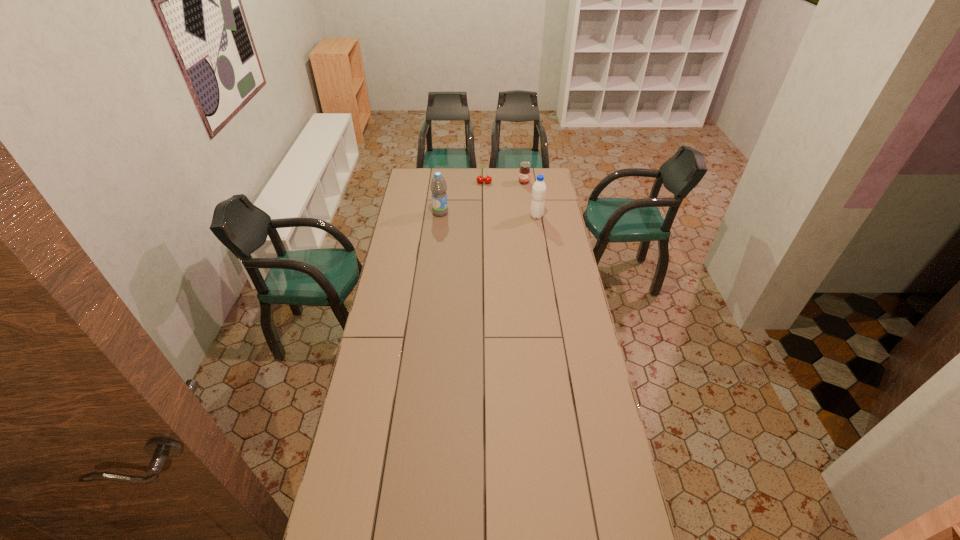
You are a GUI agent. You are given a task and a screenshot of the screen. Output one action in this format:
    pyautogui.click(x=<x>, y=<y>)
    Task: Click on the vacant region between the jam and the right water bottle
    The image size is (960, 540).
    Given the screenshot: What is the action you would take?
    pyautogui.click(x=530, y=199)

Identify the location of free space between the jam and the leftmost object. The image size is (960, 540). (482, 198).

At what (x,y) coordinates should I click in order to perform the action: click on blank region between the leftmost object and the cherry. Please return your answer as a coordinate pair (x, y). The height and width of the screenshot is (540, 960). Looking at the image, I should click on click(x=463, y=198).

Identify the location of free space between the jam and the left water bottle. (482, 198).

Where is `the closest object to the jam`? the closest object to the jam is located at coordinates (480, 179).

Identify which object is the second nearest to the third object from right to left. Please provide its 2D coordinates. Your answer should be formatted as a tuple, i.e. [(x, y)], where the tuple contains the x and y coordinates of a point satisfying the conditions above.

[(438, 185)]

Locate an element on the screen. The height and width of the screenshot is (540, 960). free location that satisfies the following two spatial constraints: 1. on the back side of the third object from right to left; 2. on the left side of the jam is located at coordinates (484, 183).

The image size is (960, 540). What are the coordinates of `vacant space that satisfies the following two spatial constraints: 1. on the back side of the second object from left to right; 2. on the right side of the jam` in the screenshot? It's located at (484, 183).

Identify the location of free location that satisfies the following two spatial constraints: 1. on the front side of the left water bottle; 2. on the left side of the right water bottle. This screenshot has height=540, width=960. (441, 216).

You are a GUI agent. You are given a task and a screenshot of the screen. Output one action in this format:
    pyautogui.click(x=<x>, y=<y>)
    Task: Click on the free space that satisfies the following two spatial constraints: 1. on the back side of the jam; 2. on the left side of the left water bottle
    This screenshot has height=540, width=960.
    Given the screenshot: What is the action you would take?
    pyautogui.click(x=444, y=183)